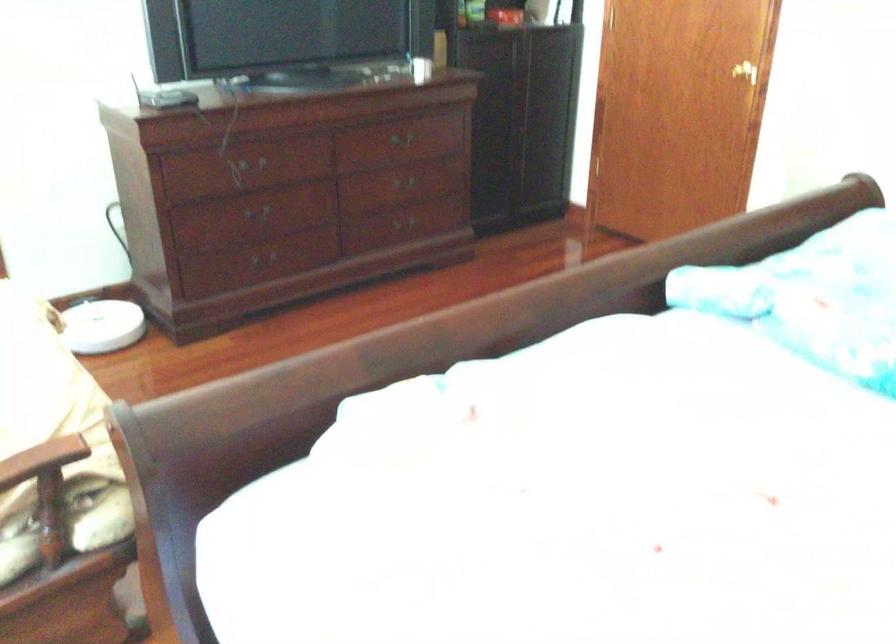
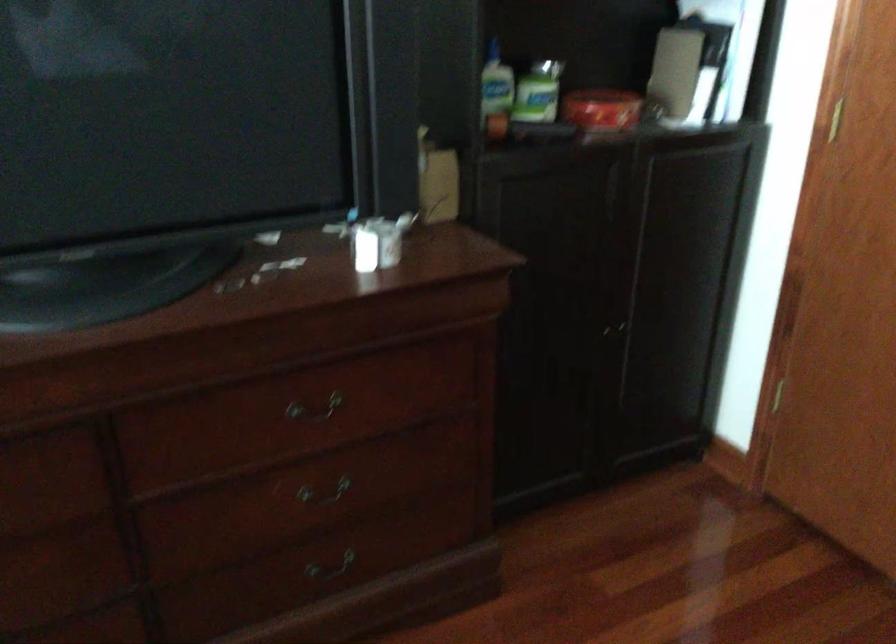
Locate, in the second image, the point that corresponds to (394,138) in the first image.

(314, 409)